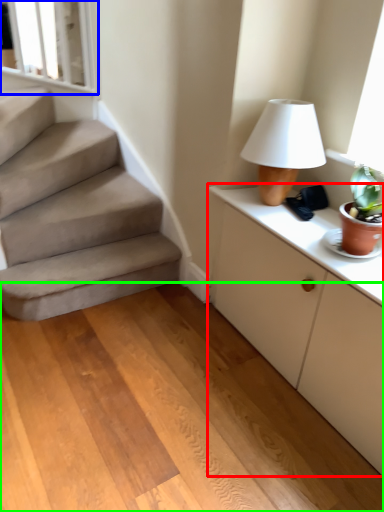
Question: Which is nearer to the cabinetry (highlighted by a red box)? window frame (highlighted by a blue box) or concrete (highlighted by a green box).

Choices:
 (A) window frame
 (B) concrete

Answer: (B)